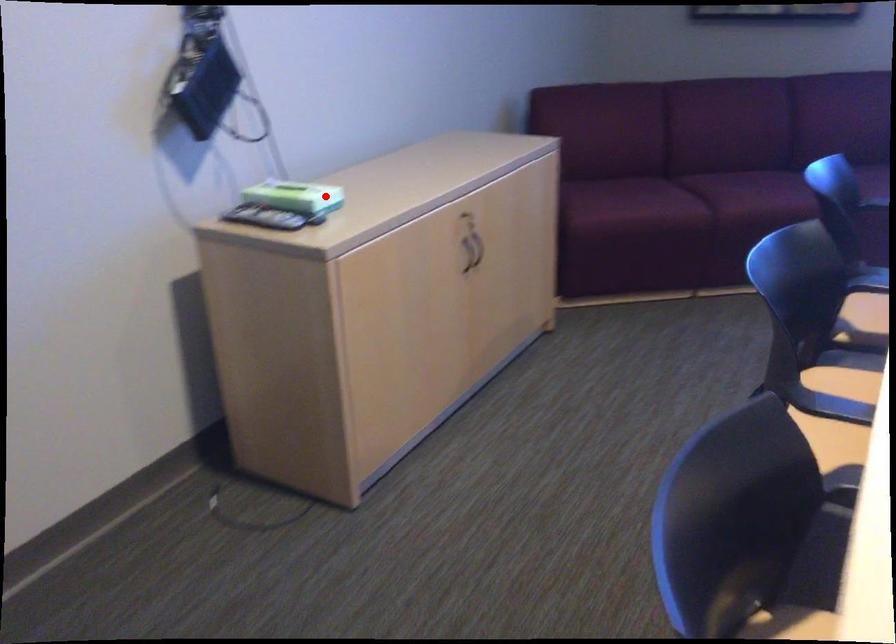
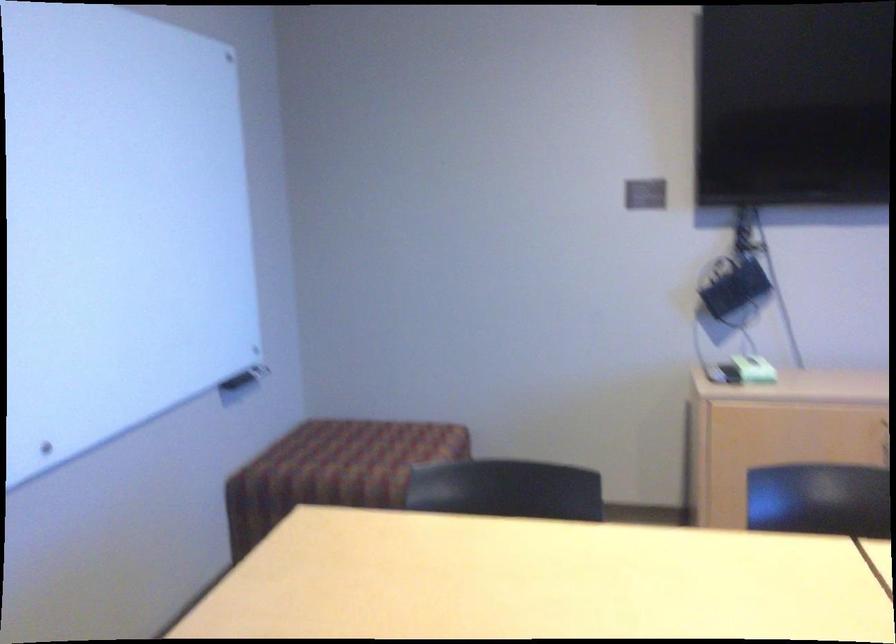
Question: I am providing you with two images of the same scene from different viewpoints. Image1 has a red point marked. In image2, the corresponding 3D location appears at what relative position? Reply with the corresponding letter.

Choices:
 (A) Closer
 (B) Farther

Answer: (B)